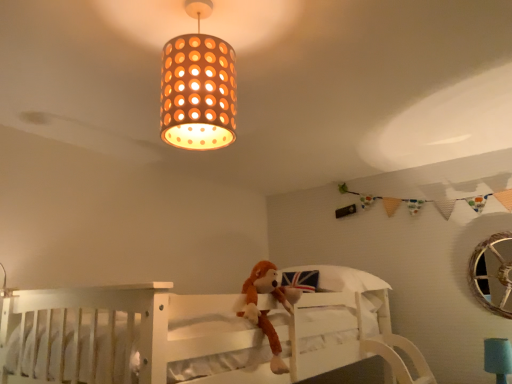
Question: From the image's perspective, does brown plush monkey at center appear lower than orange perforated paper lampshade at upper center?

Choices:
 (A) no
 (B) yes

Answer: (B)

Question: Is orange perforated paper lampshade at upper center completely or partially inside brown plush monkey at center?

Choices:
 (A) no
 (B) yes

Answer: (A)

Question: Does brown plush monkey at center have a greater height compared to orange perforated paper lampshade at upper center?

Choices:
 (A) yes
 (B) no

Answer: (A)

Question: From the image's perspective, is brown plush monkey at center on top of orange perforated paper lampshade at upper center?

Choices:
 (A) no
 (B) yes

Answer: (A)

Question: Is brown plush monkey at center oriented towards orange perforated paper lampshade at upper center?

Choices:
 (A) no
 (B) yes

Answer: (A)

Question: Does brown plush monkey at center come in front of orange perforated paper lampshade at upper center?

Choices:
 (A) no
 (B) yes

Answer: (A)

Question: Does brown plush monkey at center have a lesser width compared to teal fabric lampshade at lower right?

Choices:
 (A) yes
 (B) no

Answer: (B)

Question: Is brown plush monkey at center at the left side of teal fabric lampshade at lower right?

Choices:
 (A) no
 (B) yes

Answer: (B)

Question: From the image's perspective, is brown plush monkey at center located beneath teal fabric lampshade at lower right?

Choices:
 (A) no
 (B) yes

Answer: (A)

Question: Is brown plush monkey at center wider than teal fabric lampshade at lower right?

Choices:
 (A) yes
 (B) no

Answer: (A)

Question: From a real-world perspective, is brown plush monkey at center below teal fabric lampshade at lower right?

Choices:
 (A) no
 (B) yes

Answer: (A)

Question: Does brown plush monkey at center have a larger size compared to teal fabric lampshade at lower right?

Choices:
 (A) yes
 (B) no

Answer: (A)

Question: Is orange perforated paper lampshade at upper center wider than brown plush monkey at center?

Choices:
 (A) yes
 (B) no

Answer: (A)